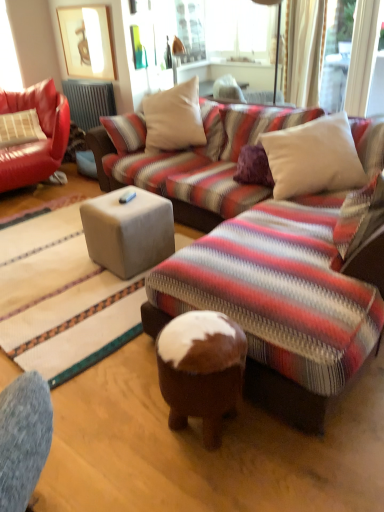
Question: Is leather couch at left further to the viewer compared to leather pillow at left, positioned as the first pillow in back-to-front order?

Choices:
 (A) yes
 (B) no

Answer: (B)

Question: Is leather couch at left to the right of leather pillow at left, placed as the second pillow when sorted from front to back, from the viewer's perspective?

Choices:
 (A) yes
 (B) no

Answer: (A)

Question: Is leather couch at left to the left of leather pillow at left, positioned as the 2th pillow in right-to-left order, from the viewer's perspective?

Choices:
 (A) yes
 (B) no

Answer: (B)

Question: Would you say leather pillow at left, positioned as the 2th pillow in right-to-left order, is part of leather couch at left's contents?

Choices:
 (A) no
 (B) yes

Answer: (B)

Question: Is leather couch at left directly adjacent to leather pillow at left, which ranks as the 1th pillow in left-to-right order?

Choices:
 (A) no
 (B) yes

Answer: (A)

Question: Can you confirm if leather couch at left is wider than leather pillow at left, positioned as the 2th pillow in right-to-left order?

Choices:
 (A) no
 (B) yes

Answer: (B)

Question: Is metallic gray radiator at upper left to the right of suede-like beige cube at center from the viewer's perspective?

Choices:
 (A) no
 (B) yes

Answer: (A)

Question: Can you confirm if metallic gray radiator at upper left is smaller than suede-like beige cube at center?

Choices:
 (A) no
 (B) yes

Answer: (B)

Question: Is metallic gray radiator at upper left located outside suede-like beige cube at center?

Choices:
 (A) yes
 (B) no

Answer: (A)

Question: From the image's perspective, is metallic gray radiator at upper left beneath suede-like beige cube at center?

Choices:
 (A) yes
 (B) no

Answer: (B)

Question: Is metallic gray radiator at upper left bigger than suede-like beige cube at center?

Choices:
 (A) yes
 (B) no

Answer: (B)

Question: From the image's perspective, does metallic gray radiator at upper left appear higher than suede-like beige cube at center?

Choices:
 (A) no
 (B) yes

Answer: (B)

Question: From the image's perspective, is leather couch at left under white soft cushion at upper right, arranged as the 2th pillow when viewed from the left?

Choices:
 (A) no
 (B) yes

Answer: (A)